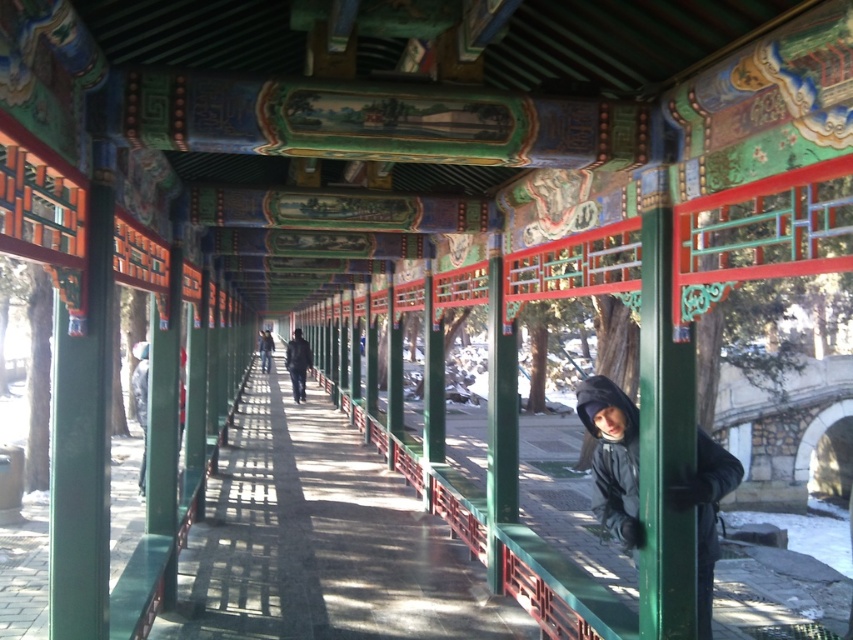
Question: Observing the image, what is the correct spatial positioning of black matte jacket at center in reference to dark blue jacket at center?

Choices:
 (A) right
 (B) left

Answer: (A)

Question: Does dark gray jacket at center have a greater width compared to dark blue jacket at center?

Choices:
 (A) no
 (B) yes

Answer: (A)

Question: Among these points, which one is nearest to the camera?

Choices:
 (A) (299, 356)
 (B) (270, 365)
 (C) (602, 413)

Answer: (C)

Question: Which of the following is the closest to the observer?

Choices:
 (A) (612, 467)
 (B) (299, 400)

Answer: (A)

Question: Does black matte jacket at center appear over dark gray jacket at center?

Choices:
 (A) no
 (B) yes

Answer: (A)

Question: Which object appears closest to the camera in this image?

Choices:
 (A) black matte jacket at center
 (B) dark gray jacket at center
 (C) dark blue jacket at center

Answer: (A)